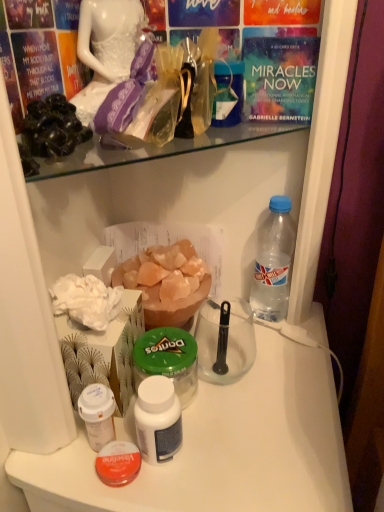
This screenshot has width=384, height=512. Identify the location of free spot in front of clear plastic bottle at right, which ranks as the 4th bottle in left-to-right order. (273, 384).